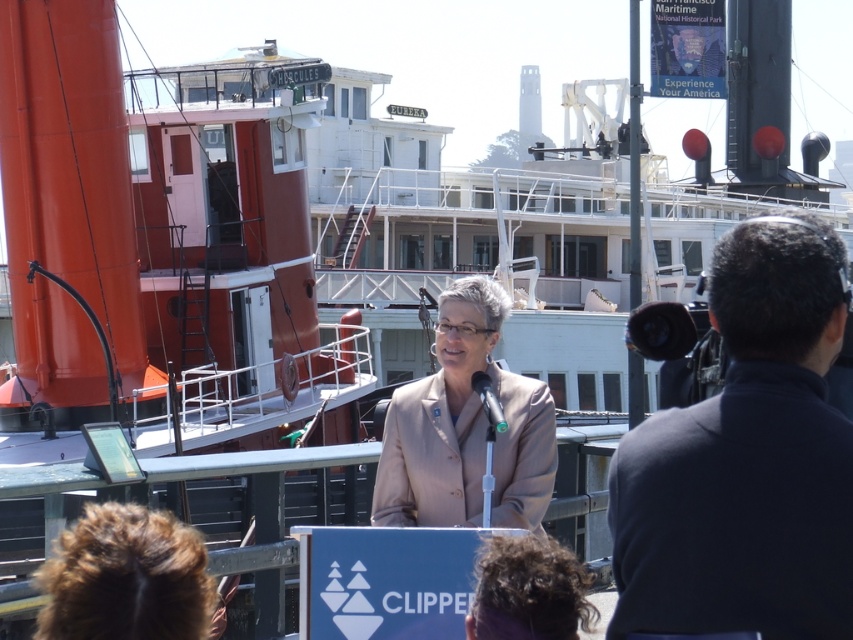
Can you confirm if beige fabric jacket at center is positioned below green matte microphone at center?

Actually, beige fabric jacket at center is above green matte microphone at center.

Locate an element on the screen. beige fabric jacket at center is located at coordinates (465, 428).

Is dark blue jacket at right behind brown fuzzy hair at lower left?

No, it is in front of brown fuzzy hair at lower left.

Is point (730, 417) closer to camera compared to point (109, 532)?

No, (730, 417) is further to viewer.

Locate an element on the screen. dark blue jacket at right is located at coordinates (746, 458).

Does dark blue jacket at right appear over beige fabric jacket at center?

No.

Does dark blue jacket at right appear on the left side of beige fabric jacket at center?

No, dark blue jacket at right is not to the left of beige fabric jacket at center.

Between point (653, 593) and point (515, 504), which one is positioned in front?

Point (653, 593)

This screenshot has height=640, width=853. In order to click on dark blue jacket at right in this screenshot , I will do `click(746, 458)`.